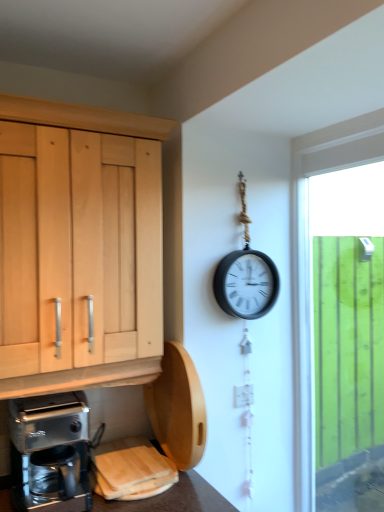
Question: Is metallic silver coffee maker at lower left aimed at green wooden fence at right?

Choices:
 (A) no
 (B) yes

Answer: (A)

Question: Can you confirm if metallic silver coffee maker at lower left is positioned to the left of green wooden fence at right?

Choices:
 (A) no
 (B) yes

Answer: (B)

Question: Considering the relative sizes of metallic silver coffee maker at lower left and green wooden fence at right in the image provided, is metallic silver coffee maker at lower left wider than green wooden fence at right?

Choices:
 (A) no
 (B) yes

Answer: (B)

Question: Considering the relative positions of metallic silver coffee maker at lower left and green wooden fence at right in the image provided, is metallic silver coffee maker at lower left to the right of green wooden fence at right from the viewer's perspective?

Choices:
 (A) no
 (B) yes

Answer: (A)

Question: Is metallic silver coffee maker at lower left completely or partially outside of green wooden fence at right?

Choices:
 (A) yes
 (B) no

Answer: (A)

Question: Is metallic silver coffee maker at lower left taller or shorter than green wooden fence at right?

Choices:
 (A) short
 (B) tall

Answer: (A)

Question: Considering the positions of metallic silver coffee maker at lower left and green wooden fence at right in the image, is metallic silver coffee maker at lower left bigger or smaller than green wooden fence at right?

Choices:
 (A) small
 (B) big

Answer: (A)

Question: Choose the correct answer: Is metallic silver coffee maker at lower left inside green wooden fence at right or outside it?

Choices:
 (A) inside
 (B) outside

Answer: (B)

Question: From the image's perspective, relative to green wooden fence at right, is metallic silver coffee maker at lower left above or below?

Choices:
 (A) below
 (B) above

Answer: (A)

Question: In terms of height, does green wooden fence at right look taller or shorter compared to white glossy electric outlet at center-right?

Choices:
 (A) tall
 (B) short

Answer: (A)

Question: In terms of size, does green wooden fence at right appear bigger or smaller than white glossy electric outlet at center-right?

Choices:
 (A) big
 (B) small

Answer: (A)

Question: Is point (340, 309) positioned closer to the camera than point (253, 395)?

Choices:
 (A) farther
 (B) closer

Answer: (A)

Question: Based on their positions, is green wooden fence at right located to the left or right of white glossy electric outlet at center-right?

Choices:
 (A) right
 (B) left

Answer: (A)

Question: Visually, is white glossy electric outlet at center-right positioned to the left or to the right of green wooden fence at right?

Choices:
 (A) right
 (B) left

Answer: (B)

Question: Do you think white glossy electric outlet at center-right is within green wooden fence at right, or outside of it?

Choices:
 (A) inside
 (B) outside

Answer: (B)